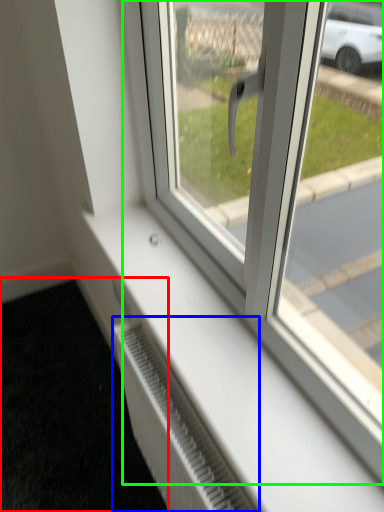
Question: Which object is positioned farthest from pavement (highlighted by a red box)? Select from radiator (highlighted by a blue box) and window (highlighted by a green box).

Choices:
 (A) radiator
 (B) window

Answer: (B)